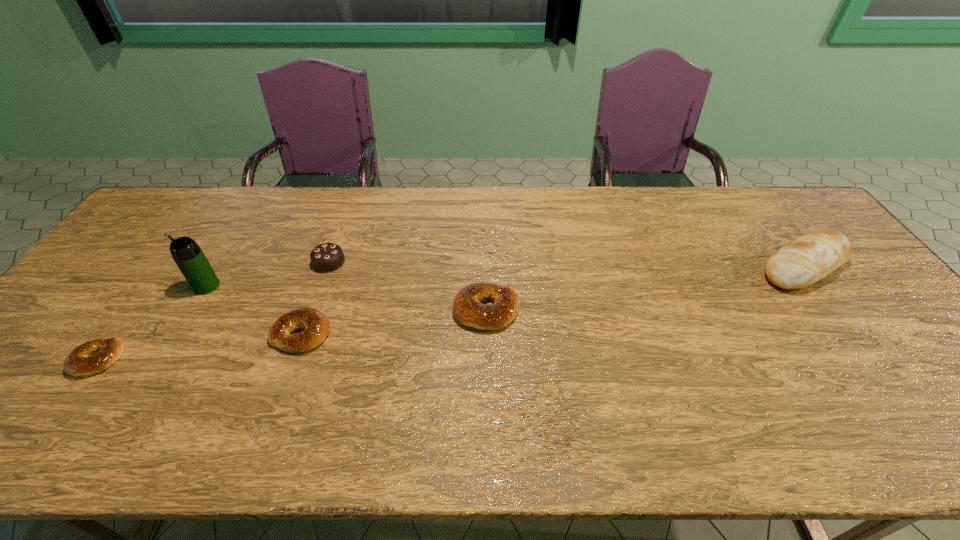
Please point a spot on the right to add another bagel. Please provide its 2D coordinates. Your answer should be formatted as a tuple, i.e. [(x, y)], where the tuple contains the x and y coordinates of a point satisfying the conditions above.

[(655, 289)]